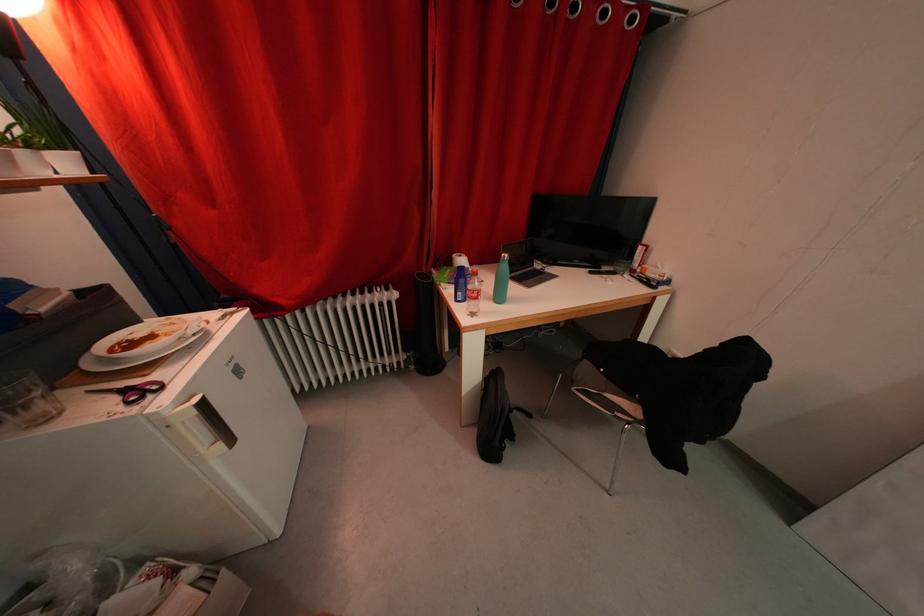
This screenshot has height=616, width=924. In order to click on fridge door handle in this screenshot , I will do pos(216,428).